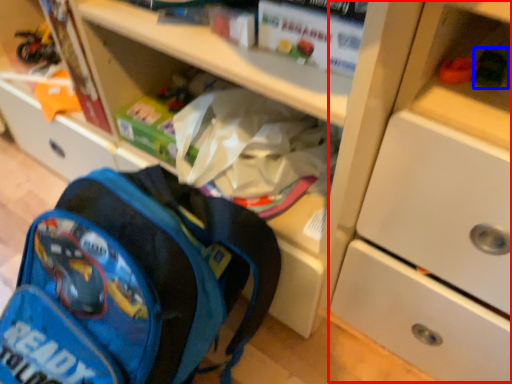
Question: Which object appears closest to the camera in this image, cabinetry (highlighted by a red box) or toy (highlighted by a blue box)?

Choices:
 (A) cabinetry
 (B) toy

Answer: (A)